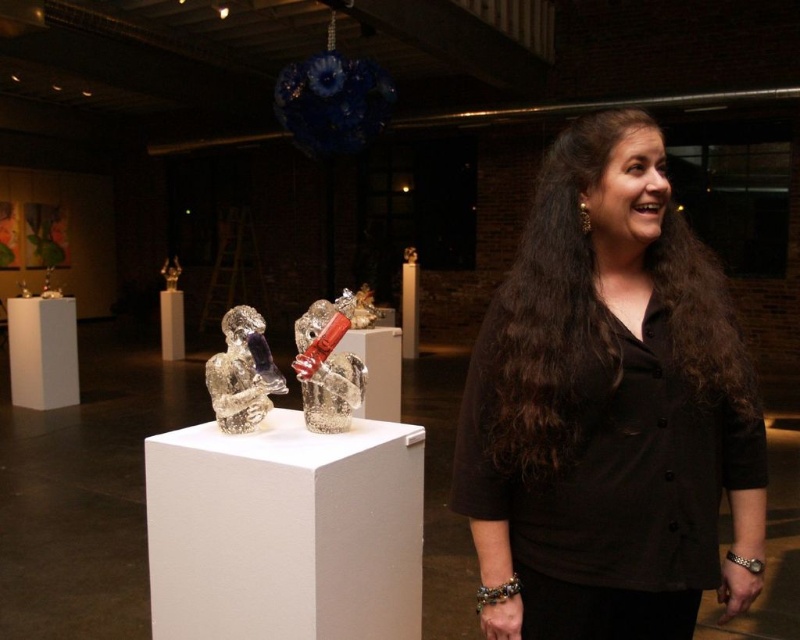
Question: Is black matte shirt at center to the left of clear glass sculpture at center from the viewer's perspective?

Choices:
 (A) yes
 (B) no

Answer: (B)

Question: Which point is closer to the camera?

Choices:
 (A) clear glass sculpture at center
 (B) clear glass sculpture at left

Answer: (A)

Question: Which point appears farthest from the camera in this image?

Choices:
 (A) coord(224,428)
 (B) coord(345,352)
 (C) coord(616,433)

Answer: (B)

Question: Can you confirm if black matte shirt at center is smaller than clear glass sculpture at center?

Choices:
 (A) yes
 (B) no

Answer: (B)

Question: Which of these objects is positioned closest to the clear glass sculpture at center?

Choices:
 (A) clear glass sculpture at left
 (B) black matte shirt at center

Answer: (A)

Question: From the image, what is the correct spatial relationship of black matte shirt at center in relation to clear glass sculpture at center?

Choices:
 (A) above
 (B) below

Answer: (B)